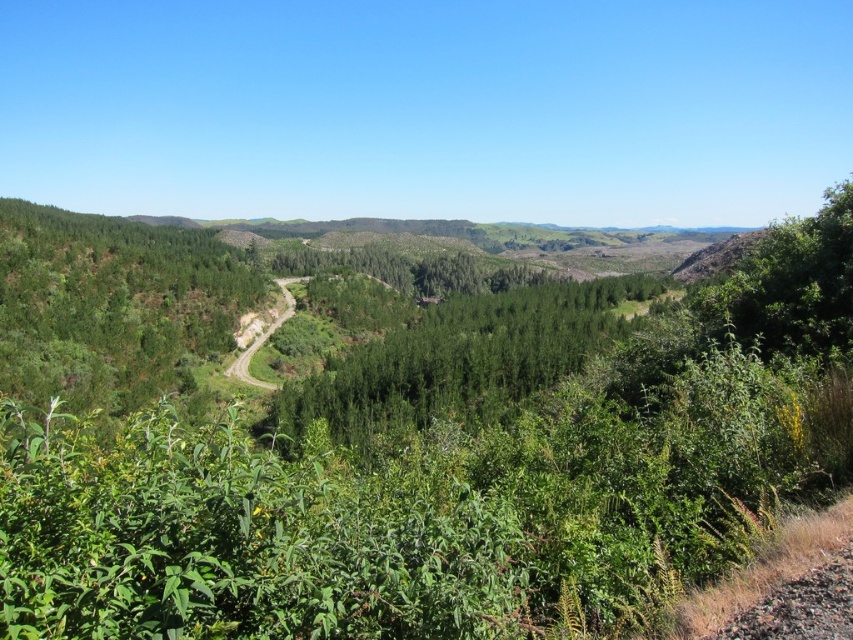
Question: Is green leafy shrub at right wider than dirt/path at center-left?

Choices:
 (A) yes
 (B) no

Answer: (A)

Question: Which point is farther from the camera taking this photo?

Choices:
 (A) [x=703, y=628]
 (B) [x=479, y=362]
 (C) [x=286, y=314]
 (D) [x=149, y=301]

Answer: (C)

Question: Considering the real-world distances, which object is closest to the green leafy trees at center?

Choices:
 (A) brown gravel dirt track at lower right
 (B) green leafy shrub at right
 (C) green leafy tree at left

Answer: (B)

Question: Which point is closer to the camera taking this photo?

Choices:
 (A) (775, 580)
 (B) (286, 304)
 (C) (306, 381)

Answer: (A)

Question: Is green leafy trees at center wider than green leafy shrub at right?

Choices:
 (A) no
 (B) yes

Answer: (B)

Question: Is green leafy trees at center closer to the viewer compared to dirt/path at center-left?

Choices:
 (A) yes
 (B) no

Answer: (A)